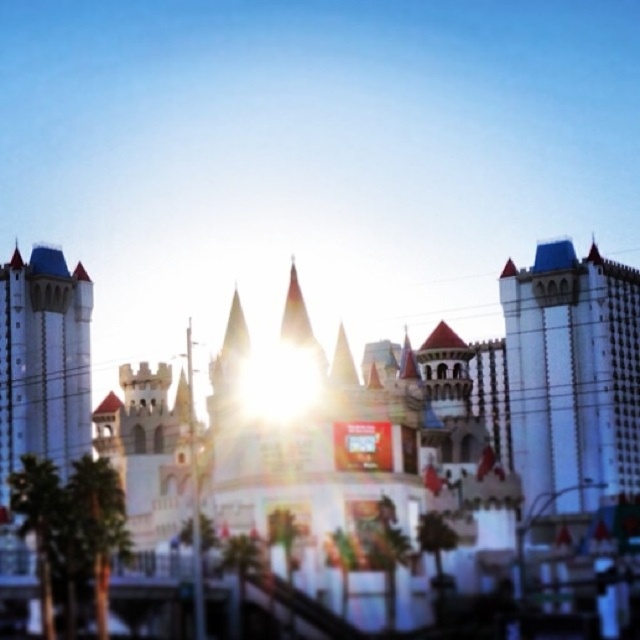
You are planning to take a photo of the white stone amusement park at center and the white stone castle at left. Considering their sizes, which one should you focus on to ensure both are fully visible in the frame without cropping?

The white stone amusement park at center is larger than the white stone castle at left, so you should focus on the amusement park to ensure both fit in the frame without cropping.

You are standing in front of the castle and want to locate two specific points marked on the image. The first point is at coordinates point (378, 586) and the second is at point (634, 438). Which of these points is closer to you?

Point (378, 586) is in front of point (634, 438), so it is closer to you.

You are planning to take a photo of the white textured building at center and the white stone castle at left. Which one should you focus on if you want to capture the tallest structure in the scene?

The white textured building at center is much taller than the white stone castle at left, so you should focus on the white textured building at center to capture the tallest structure in the scene.